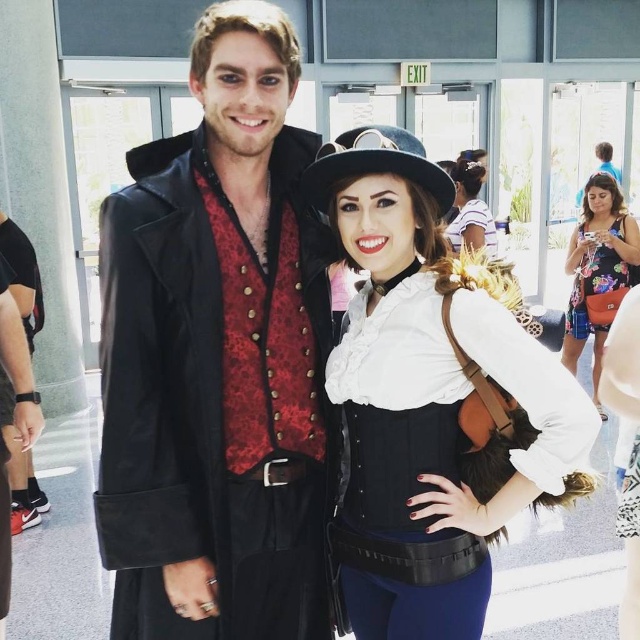
Does white matte shirt at center appear under floral dress at right?

Yes, white matte shirt at center is below floral dress at right.

Image resolution: width=640 pixels, height=640 pixels. In order to click on white matte shirt at center in this screenshot , I will do `click(433, 400)`.

Is white matte shirt at center taller than white matte hat at upper center?

Indeed, white matte shirt at center has a greater height compared to white matte hat at upper center.

Can you confirm if white matte shirt at center is shorter than white matte hat at upper center?

No.

Who is more forward, (346, 138) or (458, 243)?

Positioned in front is point (346, 138).

Find the location of a particular element. white matte shirt at center is located at coordinates (433, 400).

Between matte black coat at center and white matte shirt at center, which one appears on the left side from the viewer's perspective?

matte black coat at center is more to the left.

Does matte black coat at center come in front of white matte shirt at center?

No, matte black coat at center is further to the viewer.

Which is behind, point (125, 268) or point (588, 458)?

The point (588, 458) is more distant.

Locate an element on the screen. This screenshot has width=640, height=640. matte black coat at center is located at coordinates (218, 358).